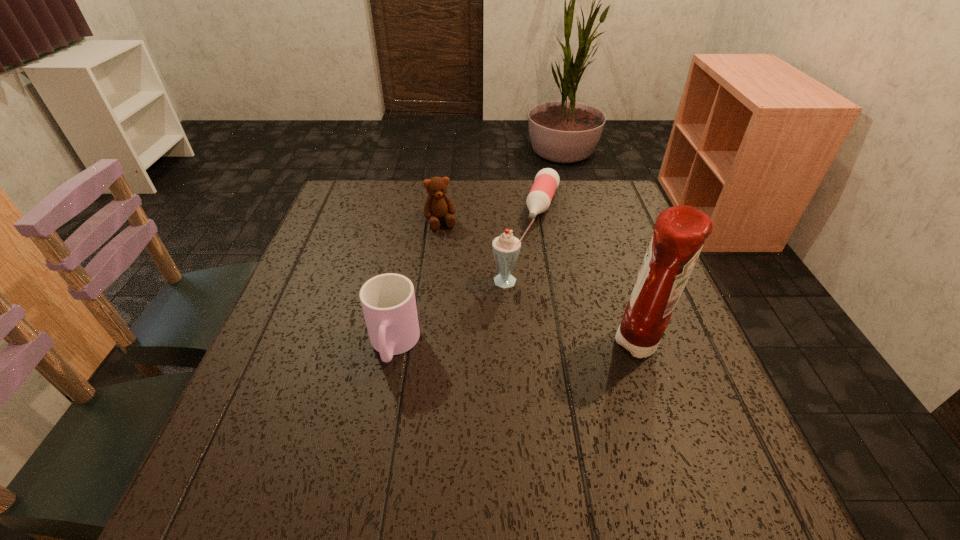
You are a GUI agent. You are given a task and a screenshot of the screen. Output one action in this format:
    pyautogui.click(x=<x>, y=<y>)
    Task: Click on the cup
    The width and height of the screenshot is (960, 540).
    Given the screenshot: What is the action you would take?
    pyautogui.click(x=388, y=301)

This screenshot has height=540, width=960. I want to click on condiment, so click(x=679, y=233).

Locate an element on the screen. The image size is (960, 540). the tallest object is located at coordinates (679, 233).

Identify the location of the shortest object. The height and width of the screenshot is (540, 960). point(547,180).

Identify the location of bottle. (547, 180).

The width and height of the screenshot is (960, 540). What are the coordinates of `teddy bear` in the screenshot? It's located at (438, 205).

Identify the location of milkshake. The width and height of the screenshot is (960, 540). (506, 248).

Where is `the third nearest object`? This screenshot has width=960, height=540. the third nearest object is located at coordinates [x=506, y=248].

You are a GUI agent. You are given a task and a screenshot of the screen. Output one action in this format:
    pyautogui.click(x=<x>, y=<y>)
    Task: Click on the blank area located 0.080m with the handle on the side of the cup
    This screenshot has width=960, height=540.
    Given the screenshot: What is the action you would take?
    pyautogui.click(x=381, y=414)

Locate an element on the screen. Image resolution: width=960 pixels, height=540 pixels. vacant space located 0.050m on the back of the tallest object is located at coordinates (627, 306).